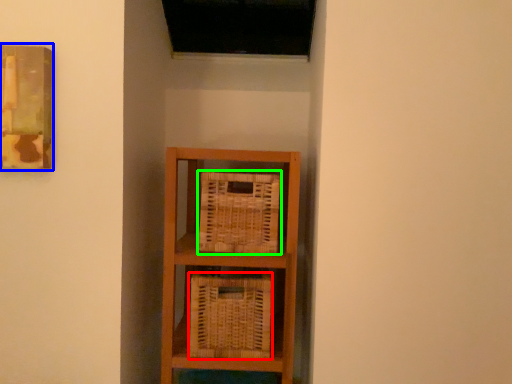
Question: Which is farther away from basket (highlighted by a red box)? picture frame (highlighted by a blue box) or basket (highlighted by a green box)?

Choices:
 (A) picture frame
 (B) basket

Answer: (A)